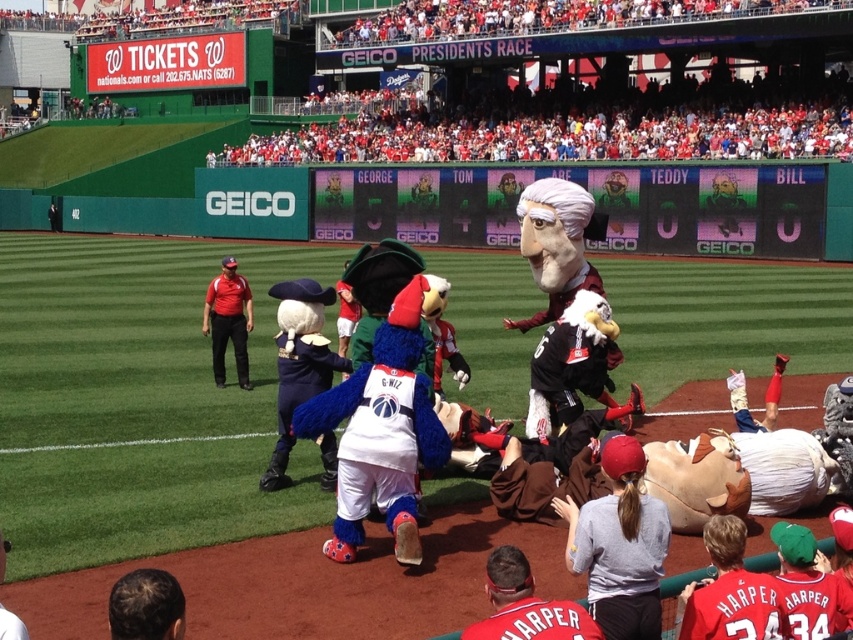
You are a photographer standing at the camera position. You want to take a closeup photo of the dark brown hair at lower left. Can you estimate how far you need to move forward to get the hair to fill the frame?

The dark brown hair at lower left is 3.96 meters from the camera. To get a closeup, you would need to move forward approximately 3.96 meters to be right in front of it, but this might not be practical depending on the lens. Alternatively, using a zoom lens could achieve the desired framing without moving closer.